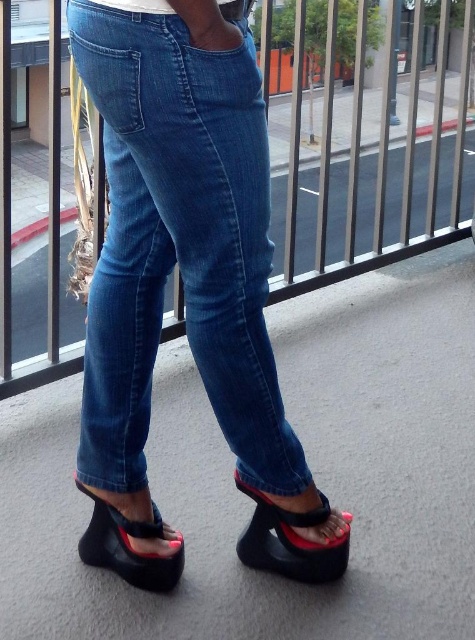
Consider the image. You are a photographer trying to capture the denim at center and the black rubber wedge sandal at lower left in the same frame. Based on their positions, which object should you adjust your focus to ensure both are in sharp focus?

The denim at center is closer to the viewer than the black rubber wedge sandal at lower left. To ensure both are in sharp focus, adjust your focus to the denim at center since it is closer, as depth of field will naturally include the farther object if focused on the closer one.

You are standing on the balcony and want to place a small potted plant at point (179, 244). Is the space at that point suitable for placing the plant?

The space at point (179, 244) is occupied by denim, so placing the plant there would not be possible.